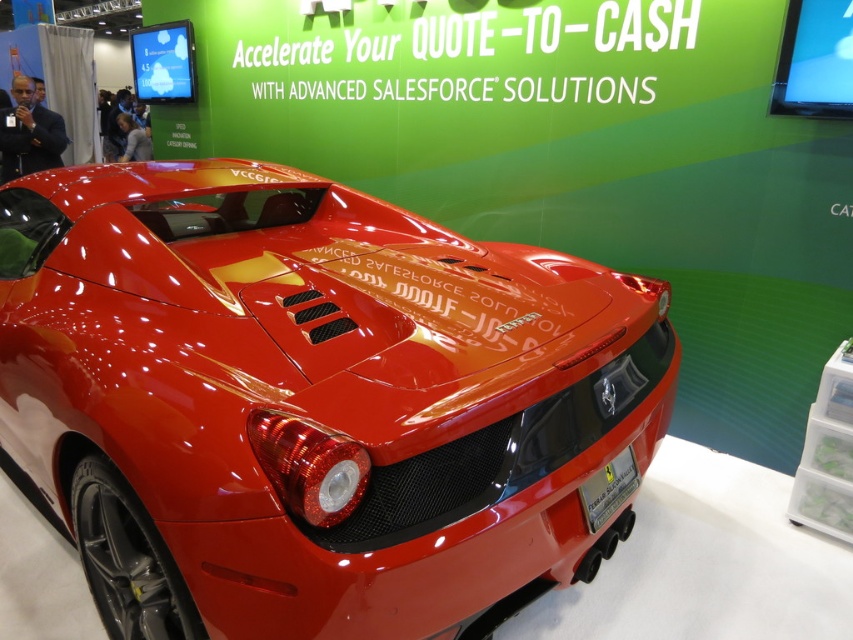
Does glossy red sports car at center come behind metallic silver license plate at center?

No, it is not.

Locate an element on the screen. glossy red sports car at center is located at coordinates (312, 401).

Find the location of a particular element. glossy red sports car at center is located at coordinates (312, 401).